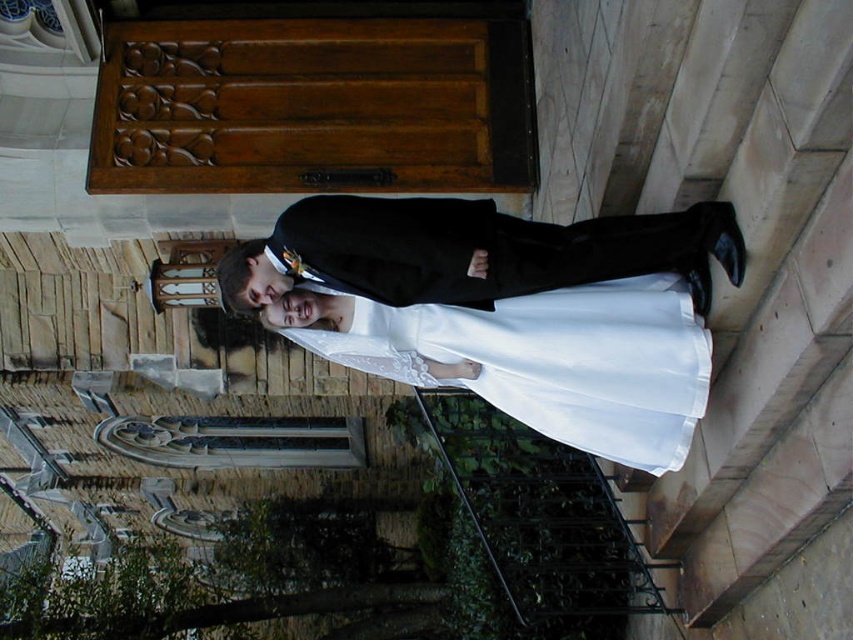
You are a photographer at the wedding and need to position yourself so that the satin white dress at center and the white satin dress at center are both in frame. Which dress should you position yourself to the left of to ensure both are visible?

You should position yourself to the left of the white satin dress at center because the satin white dress at center is to the left of it, ensuring both are visible in the frame.

In the scene shown: You are a photographer at the wedding and need to capture a shot of the couple. The satin white dress at center and the white satin dress at center are both in your viewfinder. Which dress is closer to the camera?

The satin white dress at center is closer to the camera because it is positioned under the white satin dress at center, indicating it is in front.